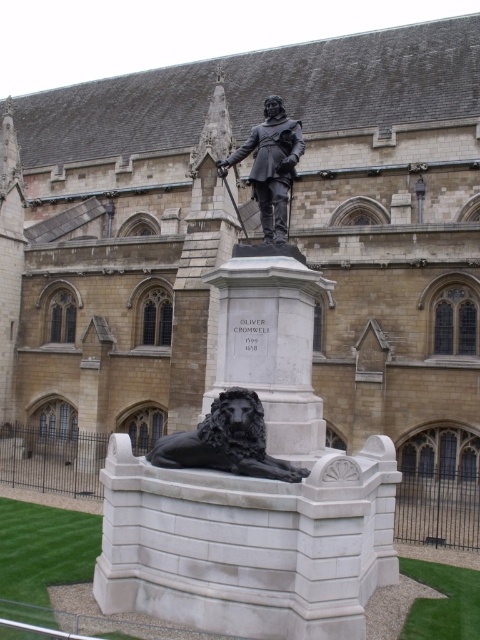
You are standing in front of the statue of Oliver Cromwell and want to take a photo of both the black polished stone lion at lower center and the bronze statue at center. Which object should you focus on first to ensure both are in the frame?

The black polished stone lion at lower center is closer to the viewer than the bronze statue at center, so you should focus on the bronze statue at center first to ensure both are in the frame.